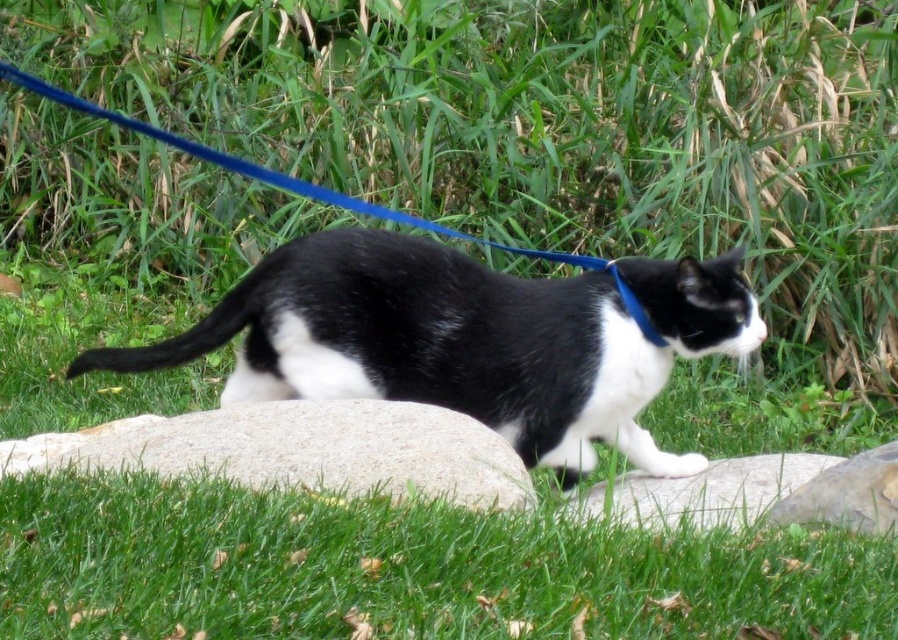
Is black/white fur cat at center closer to camera compared to gray smooth rock at center?

No, it is behind gray smooth rock at center.

Does black/white fur cat at center appear under gray smooth rock at center?

Actually, black/white fur cat at center is above gray smooth rock at center.

You are a GUI agent. You are given a task and a screenshot of the screen. Output one action in this format:
    pyautogui.click(x=<x>, y=<y>)
    Task: Click on the black/white fur cat at center
    
    Given the screenshot: What is the action you would take?
    pyautogui.click(x=468, y=339)

Is point (460, 397) in front of point (639, 310)?

Yes, it is.

In the scene shown: Can you confirm if black/white fur cat at center is positioned to the left of blue fabric neckband at center?

Correct, you'll find black/white fur cat at center to the left of blue fabric neckband at center.

Is point (707, 323) behind point (615, 268)?

No, it is not.

Find the location of `black/white fur cat at center`. black/white fur cat at center is located at coordinates (468, 339).

Is green grass at lower center positioned at the back of white granite boulder at center?

No, green grass at lower center is closer to the viewer.

Can you confirm if green grass at lower center is thinner than white granite boulder at center?

In fact, green grass at lower center might be wider than white granite boulder at center.

The image size is (898, 640). I want to click on green grass at lower center, so click(406, 570).